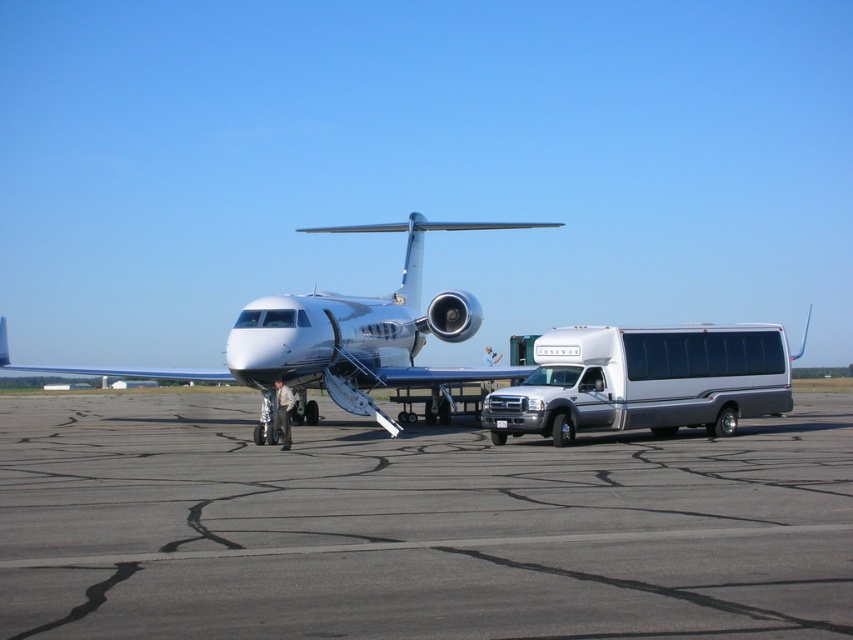
You are a maintenance worker at the airport. You need to move a ladder that is 8 meters long from the gray asphalt tarmac at center to the white glossy airplane at center. Can you move it horizontally without tilting it? Explain why.

The distance between the gray asphalt tarmac at center and the white glossy airplane at center is 7.68 meters. Since the ladder is 8 meters long, which is longer than the available space, you cannot move it horizontally without tilting it.

You are standing at the airport tarmac and want to take a photo of both point (489, 480) and point (625, 332) in the image. Which point should you focus on first to ensure both are in clear view?

You should focus on point (489, 480) first because it is closer to the camera than point (625, 332), ensuring both points are in clear view.

You are standing at the airport tarmac and want to walk from the private jet to the shuttle bus. Which point, point (x=154, y=490) or point (x=9, y=369), is closer to you as you start walking towards the shuttle bus?

Point (x=154, y=490) is closer to the viewer than point (x=9, y=369), so you will first encounter point (x=154, y=490) as you start walking towards the shuttle bus.